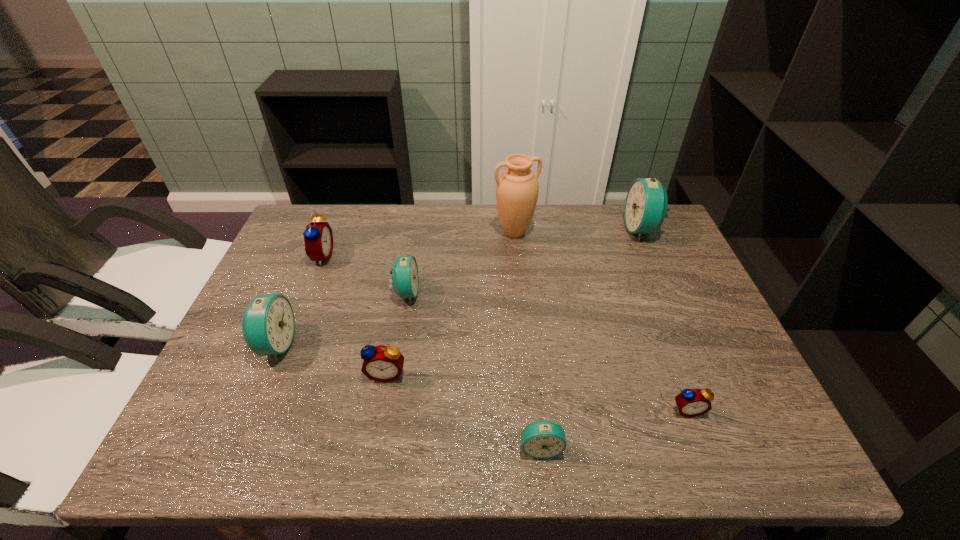
Locate an element on the screen. The image size is (960, 540). the second smallest red alarm clock is located at coordinates (381, 363).

I want to click on the nearest red alarm clock, so click(694, 402).

Find the location of `the rightmost red alarm clock`. the rightmost red alarm clock is located at coordinates (694, 402).

I want to click on the nearest object, so click(543, 439).

This screenshot has width=960, height=540. I want to click on the nearest blue alarm clock, so click(x=543, y=439).

Locate an element on the screen. Image resolution: width=960 pixels, height=540 pixels. vacant space located on the front of the urn is located at coordinates (524, 332).

I want to click on vacant space located on the front-facing side of the rightmost blue alarm clock, so click(x=519, y=230).

What are the coordinates of `free space located 0.370m on the front-facing side of the rightmost blue alarm clock` in the screenshot? It's located at (507, 230).

Image resolution: width=960 pixels, height=540 pixels. Find the location of `free space located on the front-facing side of the rightmost blue alarm clock`. free space located on the front-facing side of the rightmost blue alarm clock is located at coordinates pyautogui.click(x=536, y=230).

Where is `vacant space located on the front-facing side of the biggest red alarm clock`? The width and height of the screenshot is (960, 540). vacant space located on the front-facing side of the biggest red alarm clock is located at coordinates (363, 256).